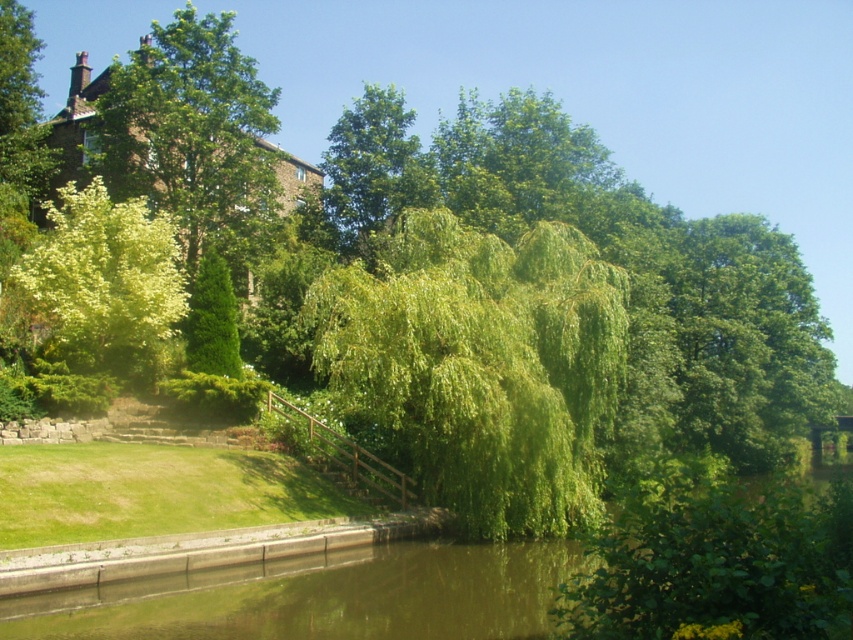
Consider the image. You are standing at the center of the image. Which direction should you walk to reach the green leafy tree at upper left?

Answer: You should walk to the upper left direction to reach the green leafy tree at upper left.

You are standing at the edge of the grassy slope near the stone wall and want to walk to the water. Which object, the green leafy tree at upper left or the green leafy willow at left, will you pass first on your way?

You will pass the green leafy tree at upper left first because the green leafy willow at left is behind it, meaning the tree is closer to your starting position at the stone wall.

You are a painter standing on the grassy slope near the stone wall. You want to paint both the green leafy willow at center and the green leafy tree at upper left. Which tree should you move closer to if you want to capture more details of its branches in your painting?

You should move closer to the green leafy willow at center because it has a lesser width compared to the green leafy tree at upper left, so getting closer would allow you to focus on its branches in detail without losing clarity.